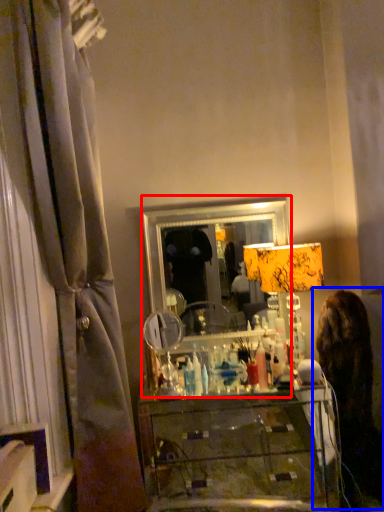
Question: Which of the following is the closest to the observer, mirror (highlighted by a red box) or woman (highlighted by a blue box)?

Choices:
 (A) mirror
 (B) woman

Answer: (B)